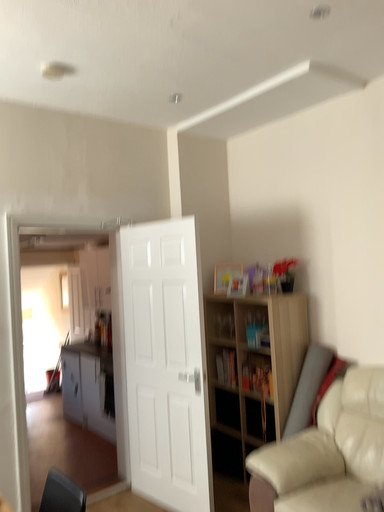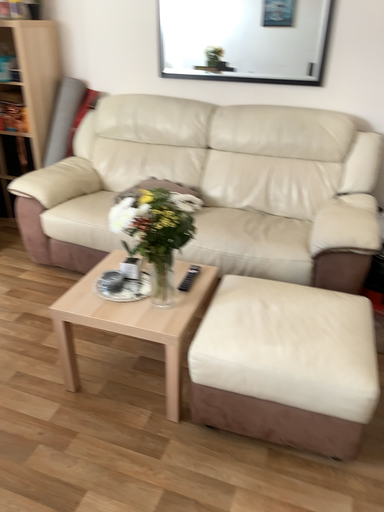
Question: Which way did the camera rotate in the video?

Choices:
 (A) rotated downward
 (B) rotated upward

Answer: (A)